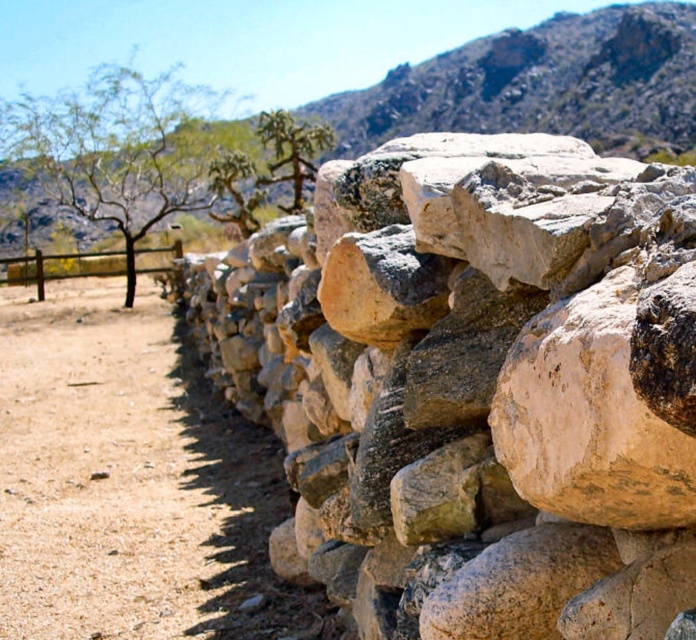
Between green leafy tree at upper left and green spiny at upper center, which one appears on the right side from the viewer's perspective?

From the viewer's perspective, green spiny at upper center appears more on the right side.

Who is higher up, green leafy tree at upper left or green spiny at upper center?

Positioned higher is green spiny at upper center.

Is point (58, 128) positioned in front of point (306, 156)?

That is False.

You are a GUI agent. You are given a task and a screenshot of the screen. Output one action in this format:
    pyautogui.click(x=<x>, y=<y>)
    Task: Click on the green leafy tree at upper left
    
    Given the screenshot: What is the action you would take?
    pyautogui.click(x=120, y=150)

Who is lower down, natural stone wall at center or green leafy tree at upper left?

natural stone wall at center is lower down.

Is natural stone wall at center below green leafy tree at upper left?

Yes, natural stone wall at center is below green leafy tree at upper left.

Who is more forward, (670, 380) or (110, 189)?

Positioned in front is point (670, 380).

Find the location of a particular element. Image resolution: width=696 pixels, height=640 pixels. natural stone wall at center is located at coordinates (475, 384).

Can you confirm if green leafy tree at upper left is thinner than brown wooden fence at left?

No.

Does green leafy tree at upper left have a greater height compared to brown wooden fence at left?

Yes, green leafy tree at upper left is taller than brown wooden fence at left.

Between point (24, 97) and point (58, 278), which one is positioned behind?

The point (24, 97) is behind.

Find the location of a particular element. The width and height of the screenshot is (696, 640). green leafy tree at upper left is located at coordinates (120, 150).